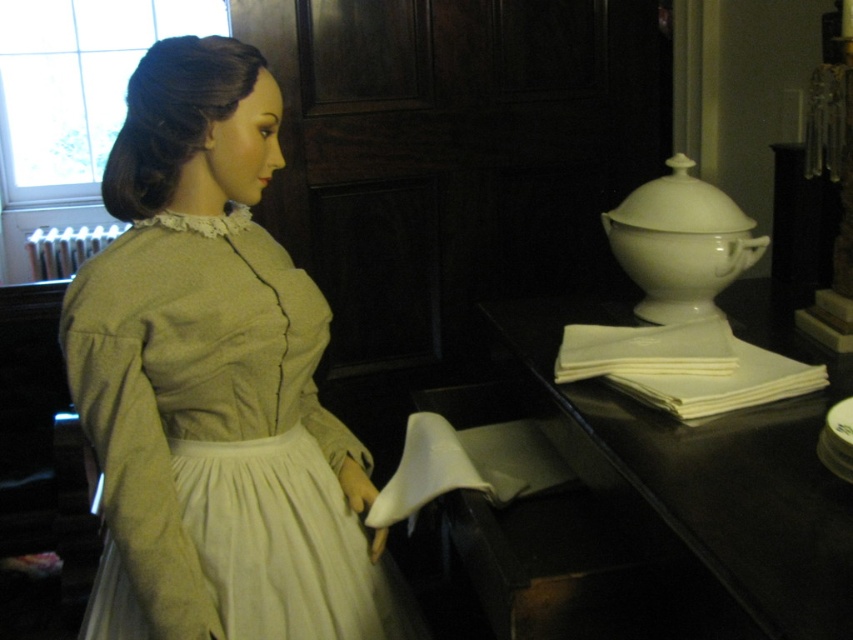
Does matte green dress at center have a lesser width compared to white matte napkins at right?

Yes, matte green dress at center is thinner than white matte napkins at right.

Who is positioned more to the right, matte green dress at center or white matte napkins at right?

white matte napkins at right is more to the right.

Between point (166, 360) and point (762, 612), which one is positioned behind?

The point (166, 360) is behind.

Find the location of `matte green dress at center`. matte green dress at center is located at coordinates (213, 384).